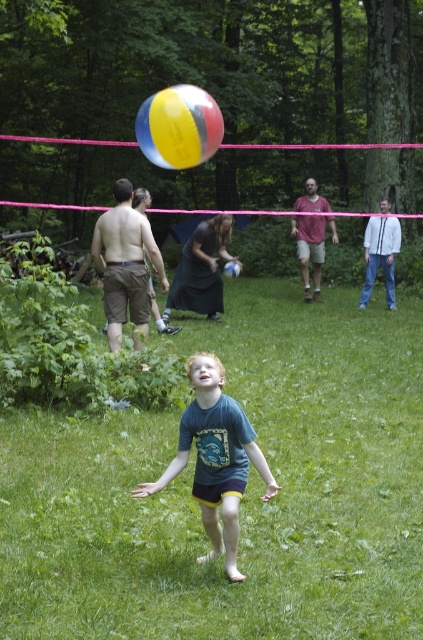
Question: Observing the image, what is the correct spatial positioning of brown cotton shorts at left in reference to matte black shorts at center?

Choices:
 (A) right
 (B) left

Answer: (B)

Question: Considering the real-world distances, which object is closest to the blue t-shirt at center?

Choices:
 (A) matte pink shirt at center
 (B) multicolored rubber volleyball at center

Answer: (A)

Question: Can you confirm if blue cotton shirt at center is bigger than matte black shorts at center?

Choices:
 (A) no
 (B) yes

Answer: (A)

Question: Which point appears closest to the camera in this image?

Choices:
 (A) (164, 168)
 (B) (294, 204)

Answer: (B)

Question: Observing the image, what is the correct spatial positioning of multicolored inflatable ball at upper center in reference to blue t-shirt at center?

Choices:
 (A) below
 (B) above

Answer: (B)

Question: Based on their relative distances, which object is farther from the brown cotton shorts at left?

Choices:
 (A) blue t-shirt at center
 (B) multicolored inflatable ball at upper center

Answer: (A)